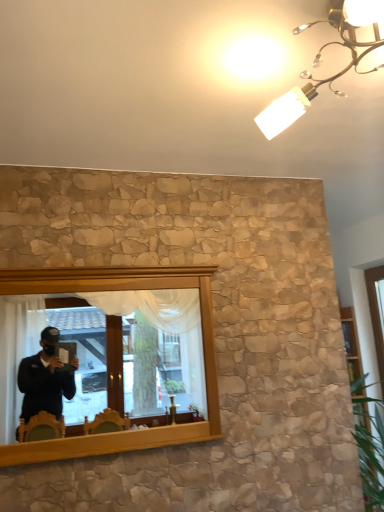
Question: Looking at the image, does wooden mirror at center seem bigger or smaller compared to white frosted glass light fixture at upper center?

Choices:
 (A) small
 (B) big

Answer: (A)

Question: Considering the positions of point (182, 315) and point (327, 78), is point (182, 315) closer or farther from the camera than point (327, 78)?

Choices:
 (A) closer
 (B) farther

Answer: (B)

Question: Would you say wooden mirror at center is inside or outside white frosted glass light fixture at upper center?

Choices:
 (A) inside
 (B) outside

Answer: (B)

Question: Looking at their shapes, would you say white frosted glass light fixture at upper center is wider or thinner than wooden mirror at center?

Choices:
 (A) thin
 (B) wide

Answer: (B)

Question: Considering the relative positions of white frosted glass light fixture at upper center and wooden mirror at center in the image provided, is white frosted glass light fixture at upper center to the left or to the right of wooden mirror at center?

Choices:
 (A) left
 (B) right

Answer: (B)

Question: Is point (345, 26) positioned closer to the camera than point (29, 351)?

Choices:
 (A) closer
 (B) farther

Answer: (A)

Question: From the image's perspective, is white frosted glass light fixture at upper center above or below wooden mirror at center?

Choices:
 (A) above
 (B) below

Answer: (A)